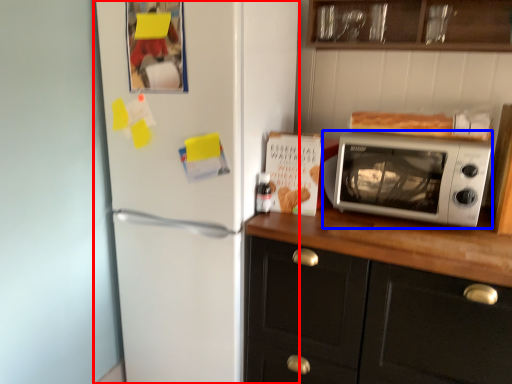
Question: Which object is further to the camera taking this photo, refrigerator (highlighted by a red box) or microwave oven (highlighted by a blue box)?

Choices:
 (A) refrigerator
 (B) microwave oven

Answer: (B)